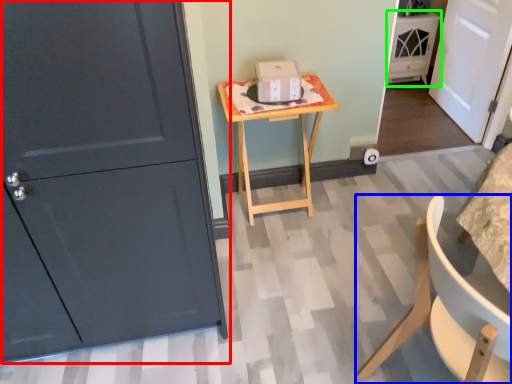
Question: Which is nearer to the door (highlighted by a red box)? chair (highlighted by a blue box) or cabinetry (highlighted by a green box).

Choices:
 (A) chair
 (B) cabinetry

Answer: (A)